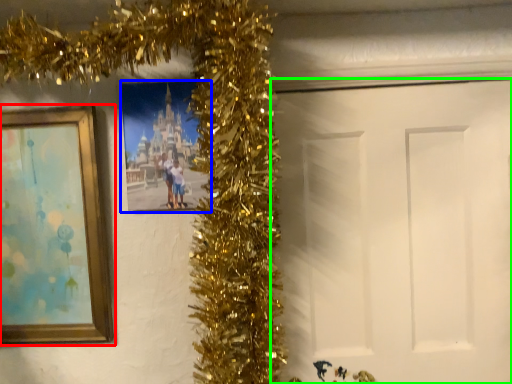
Question: Estimate the real-world distances between objects in this image. Which object is farther from picture frame (highlighted by a red box), picture frame (highlighted by a blue box) or door (highlighted by a green box)?

Choices:
 (A) picture frame
 (B) door

Answer: (B)